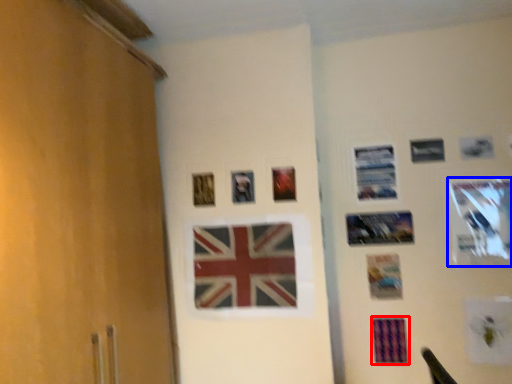
Question: Which point is closer to the camera, postcard (highlighted by a red box) or picture frame (highlighted by a blue box)?

Choices:
 (A) postcard
 (B) picture frame

Answer: (B)